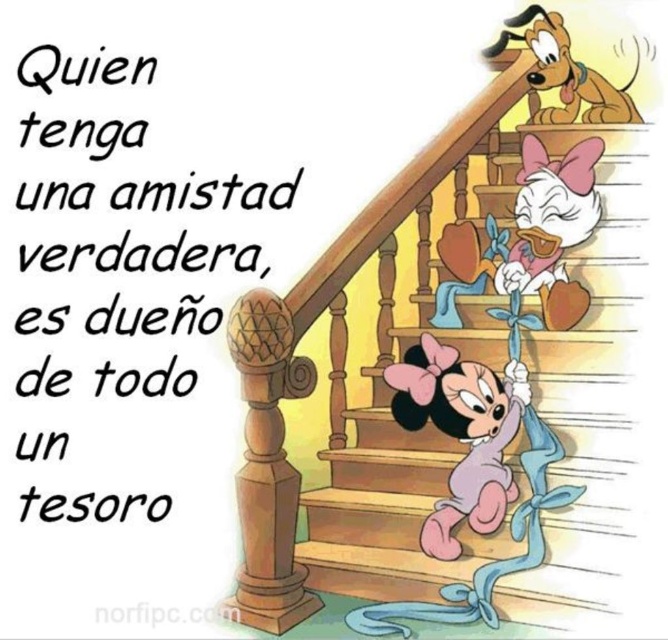
Question: Can you confirm if wooden stairs at center is bigger than pink fabric dress at center?

Choices:
 (A) yes
 (B) no

Answer: (A)

Question: Can you confirm if wooden stairs at center is positioned to the left of brown plush dog at upper right?

Choices:
 (A) yes
 (B) no

Answer: (A)

Question: Can you confirm if pink fabric minnie mouse at center is positioned above brown plush dog at upper right?

Choices:
 (A) yes
 (B) no

Answer: (B)

Question: Which point is farther from the camera taking this photo?

Choices:
 (A) (550, 42)
 (B) (582, 152)

Answer: (A)

Question: Considering the real-world distances, which object is closest to the brown plush dog at upper right?

Choices:
 (A) wooden stairs at center
 (B) pink fabric minnie mouse at center
 (C) pink fabric dress at center

Answer: (C)

Question: Among these objects, which one is farthest from the camera?

Choices:
 (A) wooden stairs at center
 (B) pink fabric dress at center
 (C) pink fabric minnie mouse at center

Answer: (B)